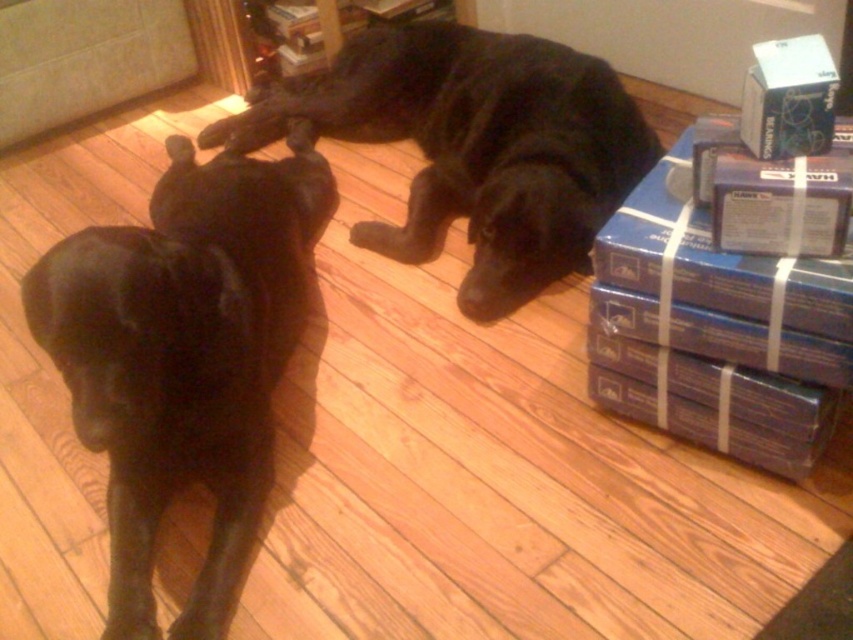
Question: Does shiny black dog at left appear under black matte dog at center?

Choices:
 (A) yes
 (B) no

Answer: (A)

Question: Is shiny black dog at left bigger than black matte dog at center?

Choices:
 (A) no
 (B) yes

Answer: (A)

Question: Among these points, which one is nearest to the camera?

Choices:
 (A) (151, 497)
 (B) (354, 52)

Answer: (A)

Question: Which point appears closest to the camera in this image?

Choices:
 (A) (231, 237)
 (B) (421, 220)

Answer: (A)

Question: Is shiny black dog at left in front of black matte dog at center?

Choices:
 (A) no
 (B) yes

Answer: (B)

Question: Which point appears farthest from the camera in this image?

Choices:
 (A) (253, 243)
 (B) (512, 122)

Answer: (B)